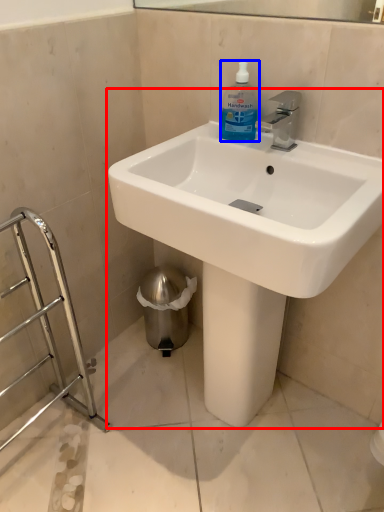
Question: Which point is further to the camera, sink (highlighted by a red box) or cleaning product (highlighted by a blue box)?

Choices:
 (A) sink
 (B) cleaning product

Answer: (B)